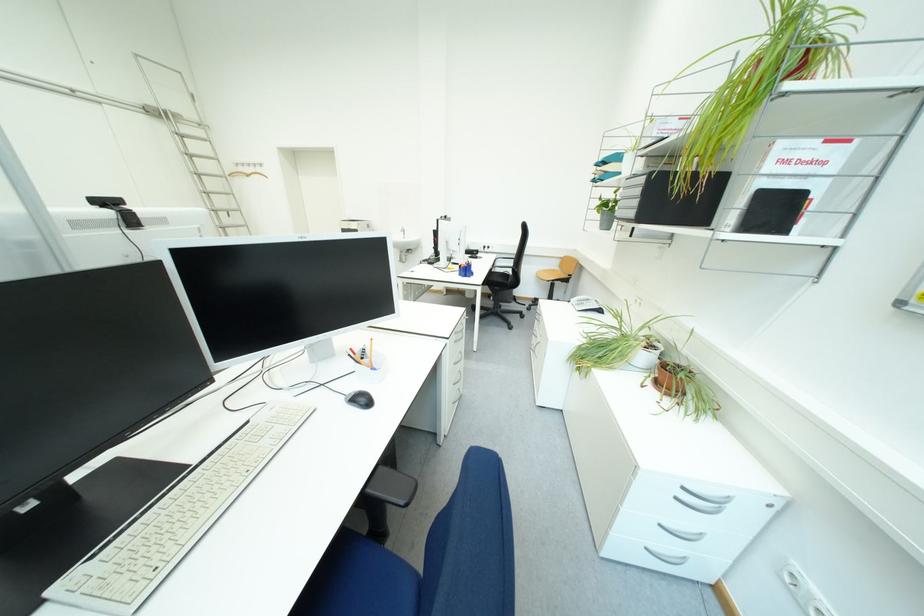
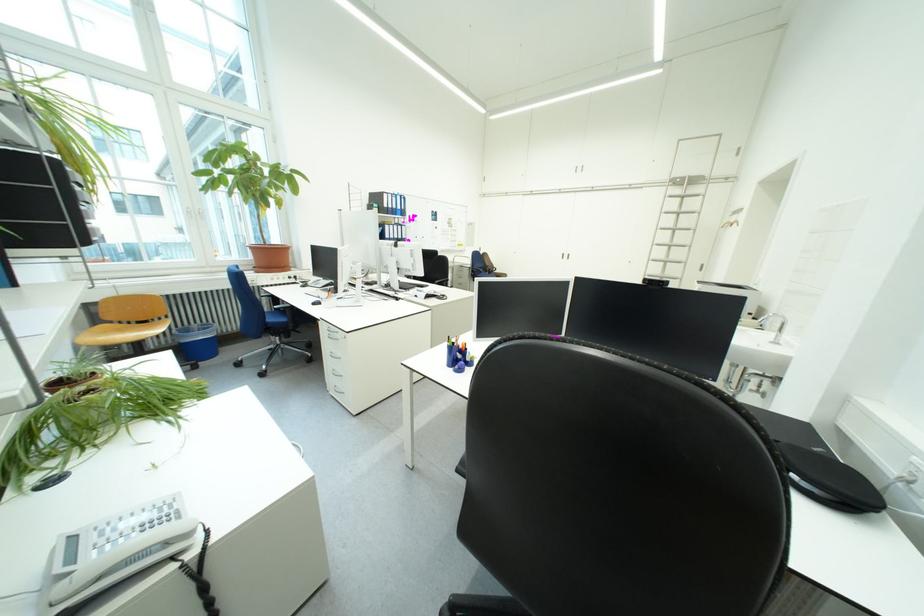
Where in the second image is the point corresponding to point 221,191 from the first image?

(687, 244)